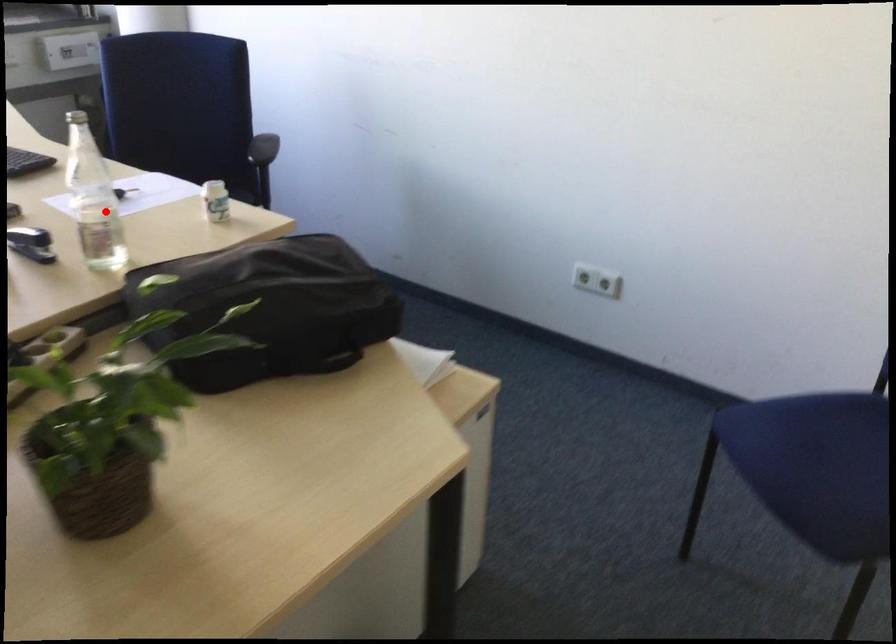
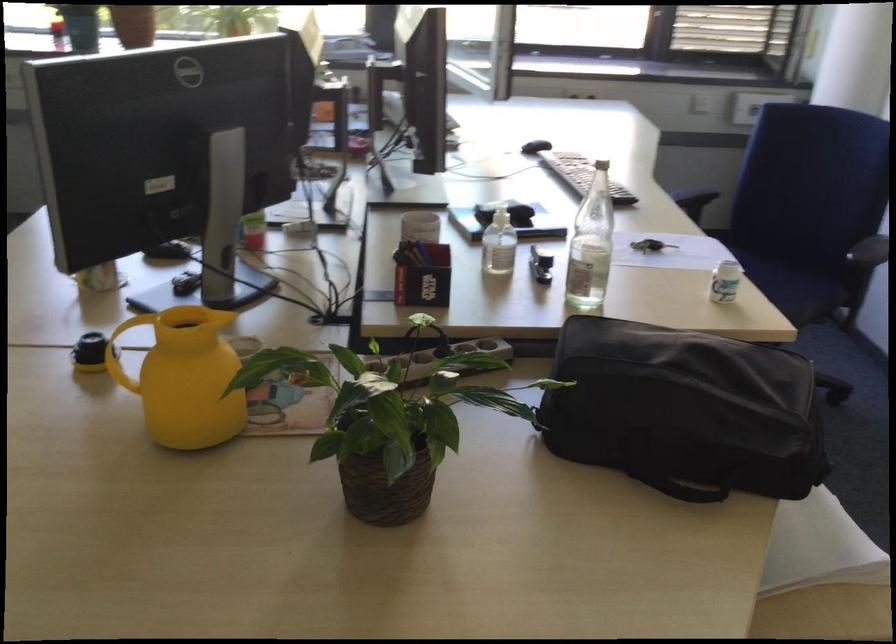
The point at the highlighted location is marked in the first image. Where is the corresponding point in the second image?

(590, 245)